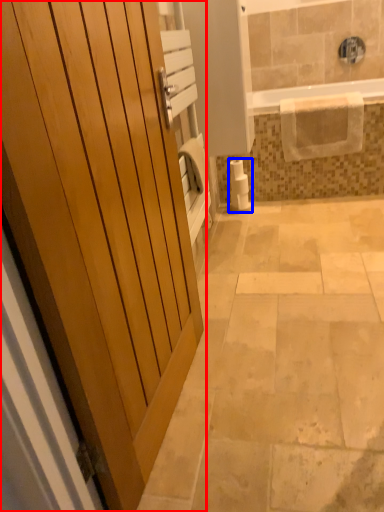
Question: Which point is further to the camera, door (highlighted by a red box) or toilet paper (highlighted by a blue box)?

Choices:
 (A) door
 (B) toilet paper

Answer: (B)